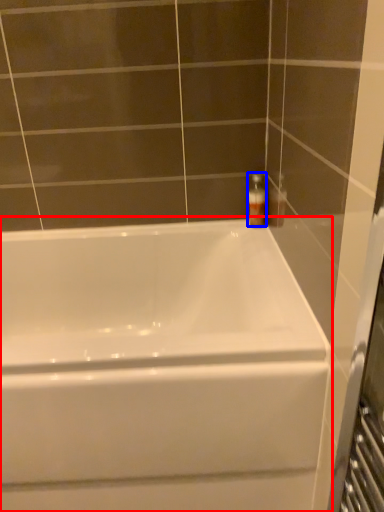
Question: Among these objects, which one is nearest to the camera, bathtub (highlighted by a red box) or soap dispenser (highlighted by a blue box)?

Choices:
 (A) bathtub
 (B) soap dispenser

Answer: (A)